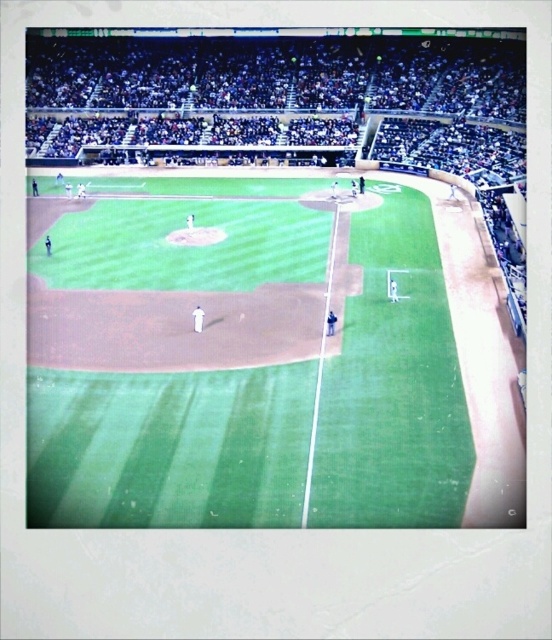
Question: Is green grass field at center closer to camera compared to green grass baseball field at center?

Choices:
 (A) yes
 (B) no

Answer: (A)

Question: Considering the relative positions of green grass field at center and green grass baseball field at center in the image provided, where is green grass field at center located with respect to green grass baseball field at center?

Choices:
 (A) above
 (B) below

Answer: (B)

Question: Can you confirm if green grass field at center is wider than green grass baseball field at center?

Choices:
 (A) yes
 (B) no

Answer: (B)

Question: Which point is farther to the camera?

Choices:
 (A) green grass field at center
 (B) green grass baseball field at center

Answer: (B)